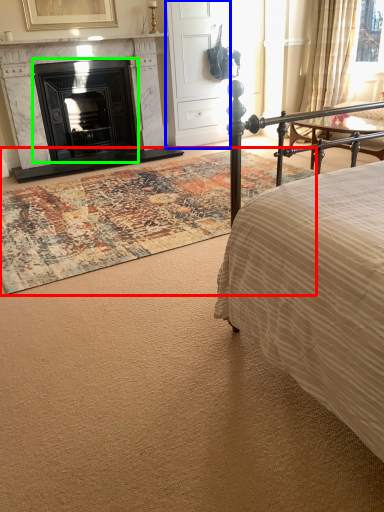
Question: Which is nearer to the mat (highlighted by a red box)? armoire (highlighted by a blue box) or fireplace (highlighted by a green box).

Choices:
 (A) armoire
 (B) fireplace

Answer: (B)